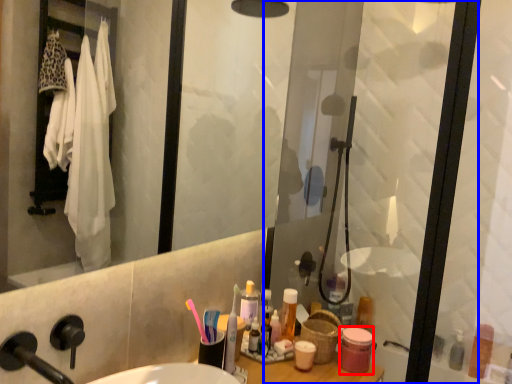
Question: Which object is further to the camera taking this photo, toiletry (highlighted by a red box) or screen door (highlighted by a blue box)?

Choices:
 (A) toiletry
 (B) screen door

Answer: (A)